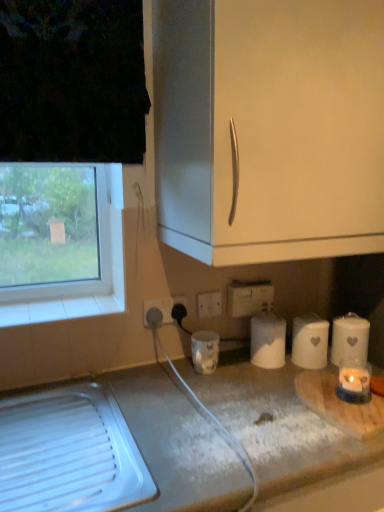
You are a GUI agent. You are given a task and a screenshot of the screen. Output one action in this format:
    pyautogui.click(x=<x>, y=<y>)
    Task: Click on the vacant area that lies between white matte paper towel at center, the third paper towel when ordered from right to left, and white ceramic candle at lower center
    The width and height of the screenshot is (384, 512).
    Given the screenshot: What is the action you would take?
    pyautogui.click(x=236, y=368)